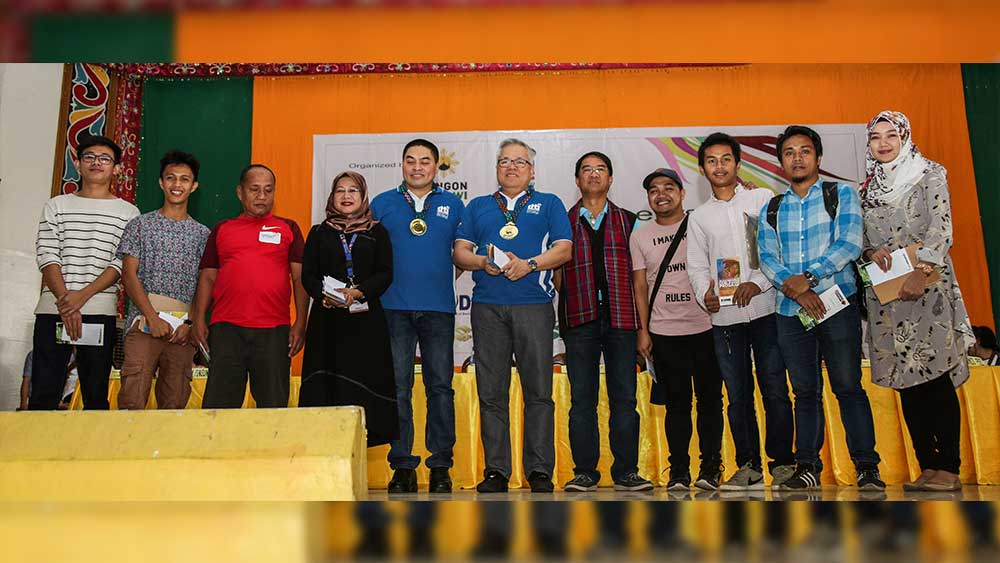
This screenshot has height=563, width=1000. What are the coordinates of `yellow divider` in the screenshot? It's located at (321, 444).